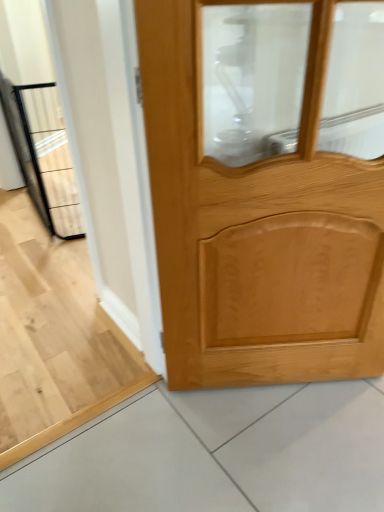
Image resolution: width=384 pixels, height=512 pixels. What do you see at coordinates (43, 154) in the screenshot? I see `black metal elevator at left` at bounding box center [43, 154].

This screenshot has width=384, height=512. What are the coordinates of `black metal elevator at left` in the screenshot? It's located at click(x=43, y=154).

What is the approximate width of black metal elevator at left?

black metal elevator at left is 14.02 inches wide.

Describe the element at coordinates (257, 229) in the screenshot. The image size is (384, 512). I see `light brown wood door at center` at that location.

This screenshot has width=384, height=512. Identify the location of light brown wood door at center. (257, 229).

Find the location of `black metal elevator at left`. black metal elevator at left is located at coordinates (43, 154).

Which is more to the left, light brown wood door at center or black metal elevator at left?

black metal elevator at left is more to the left.

Is the position of light brown wood door at center less distant than that of black metal elevator at left?

Yes, light brown wood door at center is closer to the camera.

Considering the positions of points (262, 278) and (49, 98), is point (262, 278) closer to camera compared to point (49, 98)?

That is True.

From the image's perspective, is light brown wood door at center located beneath black metal elevator at left?

Yes, from the image's perspective, light brown wood door at center is beneath black metal elevator at left.

From a real-world perspective, relative to black metal elevator at left, is light brown wood door at center vertically above or below?

light brown wood door at center is above black metal elevator at left.

Considering the sizes of objects light brown wood door at center and black metal elevator at left in the image provided, who is thinner, light brown wood door at center or black metal elevator at left?

light brown wood door at center is thinner.

Considering the sizes of objects light brown wood door at center and black metal elevator at left in the image provided, who is shorter, light brown wood door at center or black metal elevator at left?

With less height is black metal elevator at left.

Does light brown wood door at center have a smaller size compared to black metal elevator at left?

Yes.

Is light brown wood door at center inside the boundaries of black metal elevator at left, or outside?

light brown wood door at center lies outside black metal elevator at left.

Are light brown wood door at center and black metal elevator at left located far from each other?

light brown wood door at center is positioned a significant distance from black metal elevator at left.

Looking at this image, is light brown wood door at center oriented towards black metal elevator at left?

No, light brown wood door at center is not turned towards black metal elevator at left.

How many degrees apart are the facing directions of light brown wood door at center and black metal elevator at left?

The angular difference between light brown wood door at center and black metal elevator at left is 69.8 degrees.

Where is `elevator that appears on the left of light brown wood door at center`? The height and width of the screenshot is (512, 384). elevator that appears on the left of light brown wood door at center is located at coordinates tap(43, 154).

Based on their positions, is black metal elevator at left located to the left or right of light brown wood door at center?

In the image, black metal elevator at left appears on the left side of light brown wood door at center.

Which object is further away from the camera taking this photo, black metal elevator at left or light brown wood door at center?

Positioned behind is black metal elevator at left.

Is point (58, 210) closer to camera compared to point (175, 124)?

No, it is behind (175, 124).

From the image's perspective, which one is positioned lower, black metal elevator at left or light brown wood door at center?

light brown wood door at center appears lower in the image.

Consider the image. From a real-world perspective, is black metal elevator at left physically located above or below light brown wood door at center?

black metal elevator at left is below light brown wood door at center.

Looking at this image, considering the sizes of objects black metal elevator at left and light brown wood door at center in the image provided, who is thinner, black metal elevator at left or light brown wood door at center?

light brown wood door at center.

Based on the photo, which of these two, black metal elevator at left or light brown wood door at center, stands taller?

light brown wood door at center.

Considering the sizes of black metal elevator at left and light brown wood door at center in the image, is black metal elevator at left bigger or smaller than light brown wood door at center?

Clearly, black metal elevator at left is larger in size than light brown wood door at center.

Would you say light brown wood door at center is part of black metal elevator at left's contents?

No, light brown wood door at center is located outside of black metal elevator at left.

Would you say black metal elevator at left is a long distance from light brown wood door at center?

Absolutely, black metal elevator at left is distant from light brown wood door at center.

Is light brown wood door at center at the back of black metal elevator at left?

black metal elevator at left does not have its back to light brown wood door at center.

This screenshot has height=512, width=384. Find the location of `elevator that is under the light brown wood door at center (from a real-world perspective)`. elevator that is under the light brown wood door at center (from a real-world perspective) is located at coordinates (43, 154).

Locate an element on the screen. The height and width of the screenshot is (512, 384). door located below the black metal elevator at left (from the image's perspective) is located at coordinates (257, 229).

Where is `elevator that appears above the light brown wood door at center (from the image's perspective)`? elevator that appears above the light brown wood door at center (from the image's perspective) is located at coordinates (43, 154).